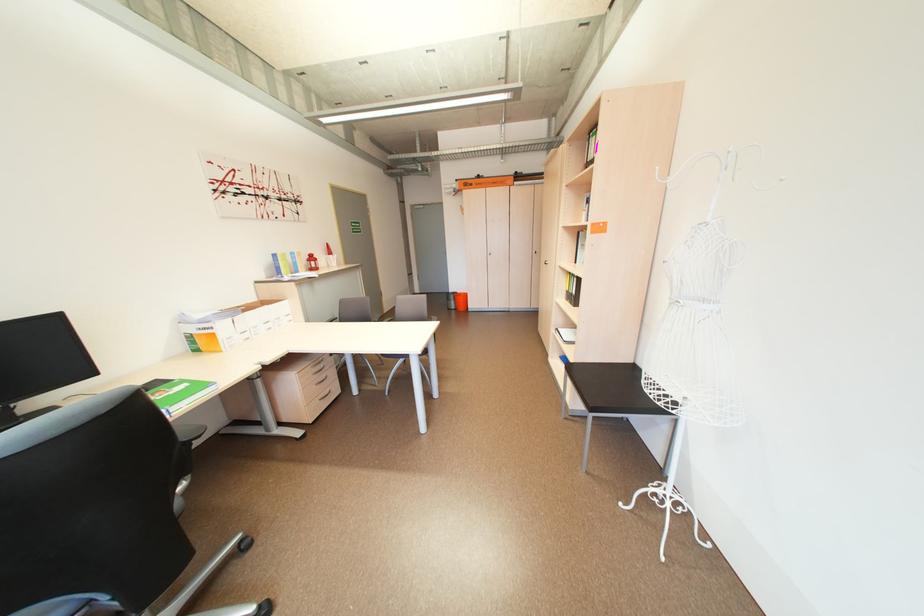
Where is `drawer handle`? drawer handle is located at coordinates (327, 394).